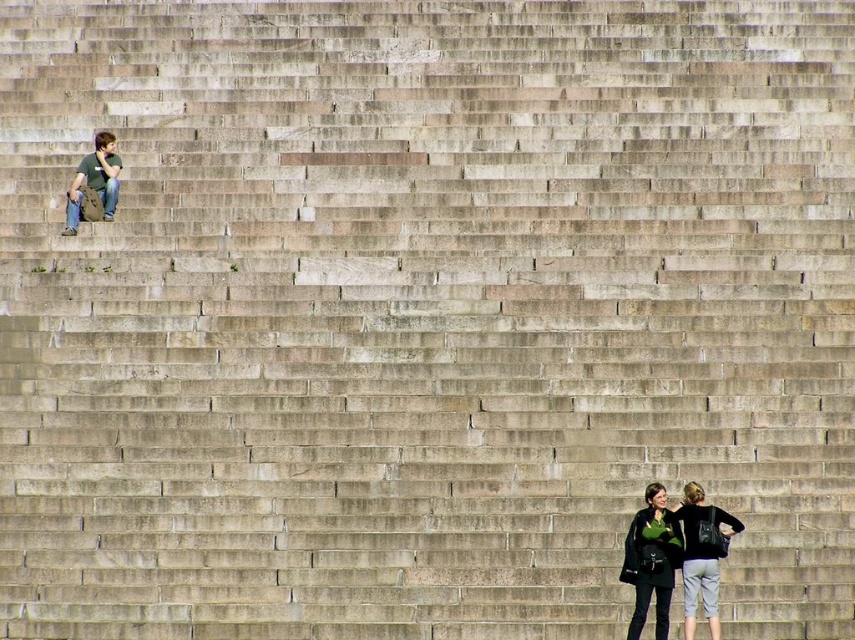
Can you confirm if green fabric jacket at lower right is positioned to the right of matte green shirt at upper left?

Yes, green fabric jacket at lower right is to the right of matte green shirt at upper left.

Does green fabric jacket at lower right have a greater width compared to matte green shirt at upper left?

Correct, the width of green fabric jacket at lower right exceeds that of matte green shirt at upper left.

Find the location of `green fabric jacket at lower right`. green fabric jacket at lower right is located at coordinates (675, 557).